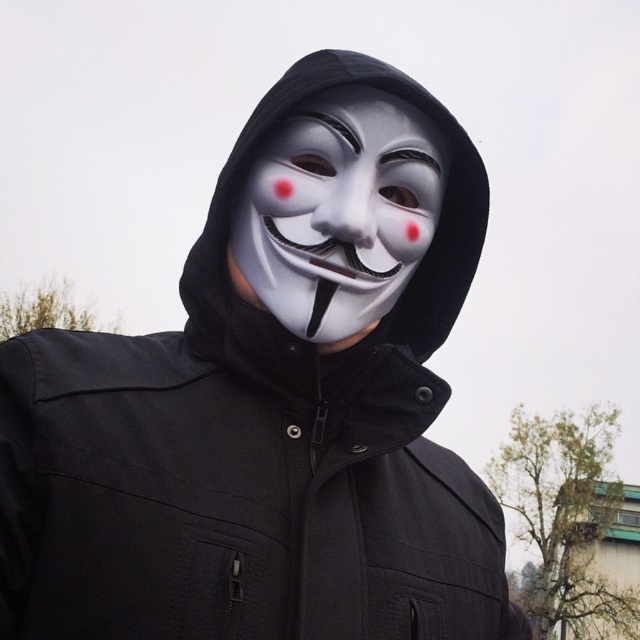
You are a photographer standing at a certain distance from the white matte mask at center. You want to capture a closeup shot of the mask without any distortion. The recommended distance for such a shot is between 3 to 4 feet. Can you take the photo as planned?

The distance between you and the white matte mask at center is 4.06 feet, which is slightly beyond the recommended 3 to 4 feet range. To avoid distortion, you should move closer to ensure the distance is within the recommended range before taking the photo.